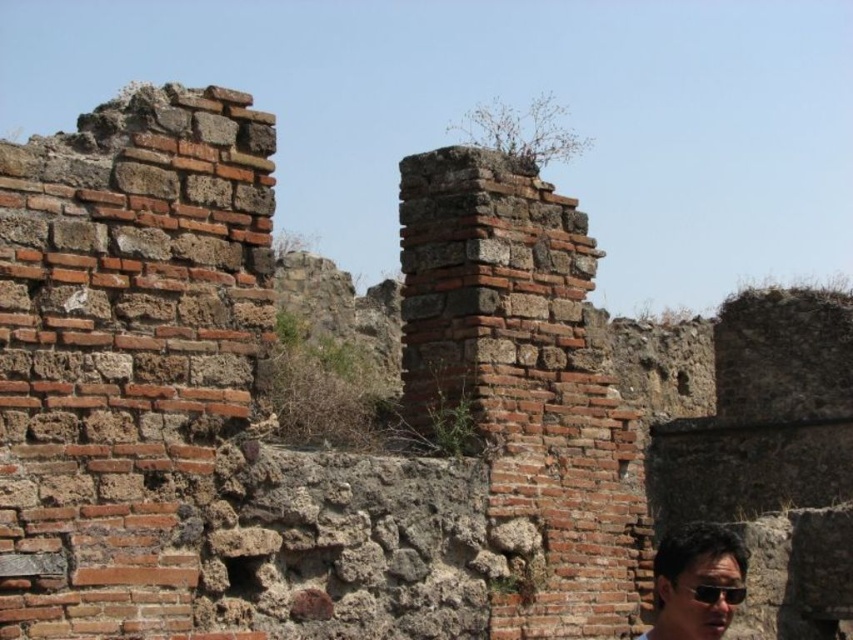
Is matte black sunglasses at lower right closer to camera compared to black plastic goggles at lower right?

Yes, matte black sunglasses at lower right is in front of black plastic goggles at lower right.

Between matte black sunglasses at lower right and black plastic goggles at lower right, which one appears on the right side from the viewer's perspective?

From the viewer's perspective, matte black sunglasses at lower right appears more on the right side.

Between point (695, 600) and point (733, 584), which one is positioned in front?

Point (695, 600) is in front.

At what (x,y) coordinates should I click in order to perform the action: click on matte black sunglasses at lower right. Please return your answer as a coordinate pair (x, y). This screenshot has width=853, height=640. Looking at the image, I should click on coord(695,580).